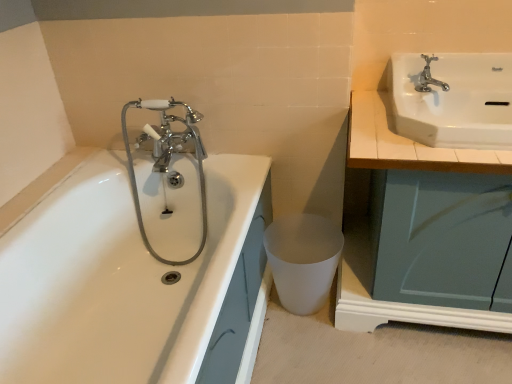
Locate an element on the screen. vacant area to the left of chrome metallic faucet at upper right is located at coordinates (372, 102).